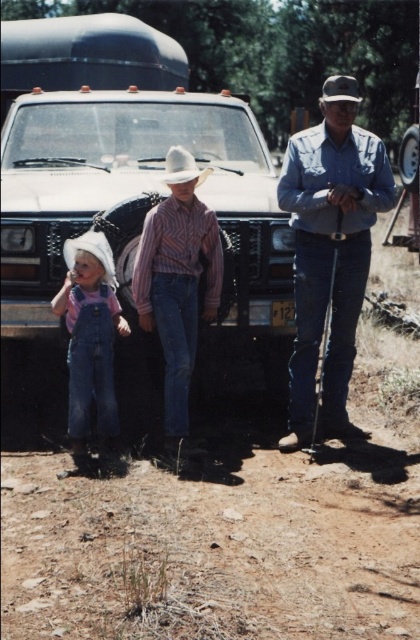
You are a delivery person who needs to load a package onto the matte white truck at center. You are currently standing next to the blue denim jeans at right. Is the distance between you and the truck sufficient to carry the package without needing to move closer?

The distance between the matte white truck at center and the blue denim jeans at right is 1.28 meters, so yes, the delivery person can carry the package to the matte white truck at center from the blue denim jeans at right without needing to move closer, as 1.28 meters is a manageable distance for carrying a package.

You are a photographer positioned behind the camera capturing this scene. You need to ensure both the blue denim jeans at right and the denim overalls at left are in focus. Given that your camera can focus on objects within a 4 feet range, will both subjects be in focus?

The distance between blue denim jeans at right and denim overalls at left is 4.56 feet, which exceeds the camera focus range of 4 feet. Therefore, both subjects cannot be in focus simultaneously.

You are a photographer setting up for a group photo. You notice the striped cotton shirt at center and the white felt cowboy hat at center. Which object should you adjust to ensure both are centered in the frame?

The striped cotton shirt at center is positioned on the left side of the white felt cowboy hat at center. To center both in the frame, adjust the striped cotton shirt at center to move it to the right so it aligns centrally with the white felt cowboy hat at center.